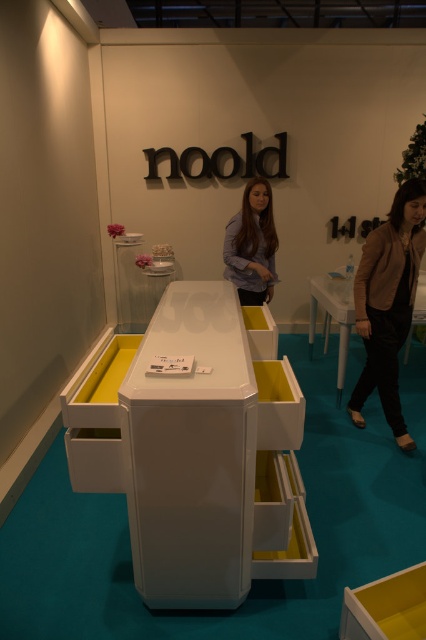
Question: Which object is farther from the camera taking this photo?

Choices:
 (A) black leather jacket at right
 (B) white glossy table at center
 (C) matte blue shirt at center

Answer: (B)

Question: Is black leather jacket at right bigger than white glossy table at center?

Choices:
 (A) no
 (B) yes

Answer: (A)

Question: Which of the following is the closest to the observer?

Choices:
 (A) (273, 291)
 (B) (408, 236)
 (C) (416, 310)

Answer: (B)

Question: Considering the real-world distances, which object is farthest from the matte blue shirt at center?

Choices:
 (A) black leather jacket at right
 (B) white glossy table at center

Answer: (A)

Question: Considering the relative positions of matte blue shirt at center and white glossy table at center in the image provided, where is matte blue shirt at center located with respect to white glossy table at center?

Choices:
 (A) right
 (B) left

Answer: (B)

Question: Is the position of black leather jacket at right less distant than that of white glossy table at center?

Choices:
 (A) no
 (B) yes

Answer: (B)